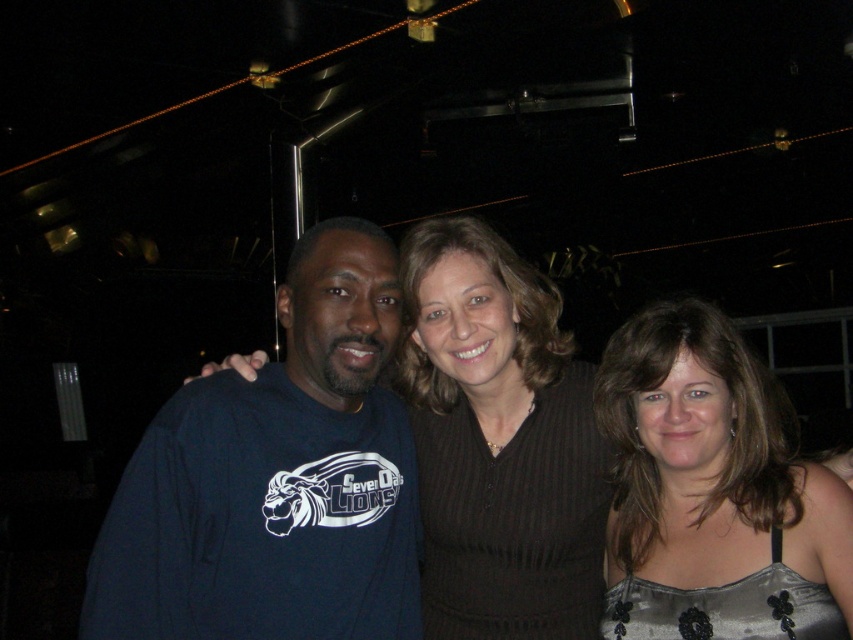
You are a photographer at the event and want to ensure that both the dark blue sweatshirt at left and the silvery satin dress at center are clearly visible in the photo. Given their height difference, which one might appear larger in the final image?

The dark blue sweatshirt at left is much taller than the silvery satin dress at center, so it will appear larger in the photo.